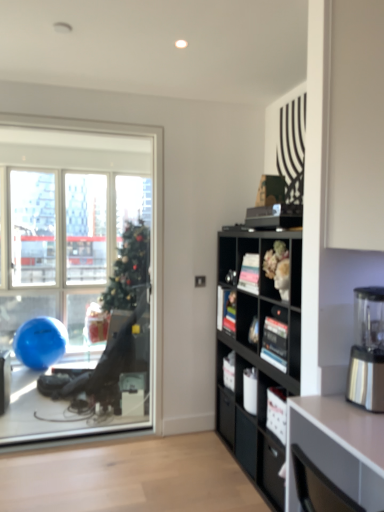
In order to face white glossy desk at lower right, should I rotate leftwards or rightwards?

It's best to rotate right around 22.415 degrees.

Identify the location of white glossy desk at lower right. Image resolution: width=384 pixels, height=512 pixels. (338, 447).

What is the approximate height of matte black bookshelf at center?

9.51 inches.

The width and height of the screenshot is (384, 512). What do you see at coordinates (257, 353) in the screenshot?
I see `black matte bookshelf at center-right` at bounding box center [257, 353].

Find the location of a particular element. stainless steel blender at right is located at coordinates (367, 350).

Where is `transparent glass window at left`? transparent glass window at left is located at coordinates (82, 272).

Find the location of a particular element. white glossy desk at lower right is located at coordinates (338, 447).

Considering the points (370, 478) and (65, 205), which point is in front, point (370, 478) or point (65, 205)?

Positioned in front is point (370, 478).

Locate an element on the screen. desk below the transparent glass window at left (from the image's perspective) is located at coordinates (338, 447).

Which object is closer to the camera taking this photo, white glossy desk at lower right or transparent glass window at left?

white glossy desk at lower right is closer to the camera.

Between point (370, 308) and point (332, 401), which one is positioned in front?

The point (332, 401) is in front.

Does stainless steel blender at right turn towards white glossy desk at lower right?

No, stainless steel blender at right is not aimed at white glossy desk at lower right.

Where is `coffee machine that is above the white glossy desk at lower right (from the image's perspective)`? The height and width of the screenshot is (512, 384). coffee machine that is above the white glossy desk at lower right (from the image's perspective) is located at coordinates (367, 350).

From the image's perspective, between stainless steel blender at right and white glossy desk at lower right, who is located below?

white glossy desk at lower right is shown below in the image.

Is point (294, 361) positioned before point (285, 505)?

No, it is not.

Considering the relative positions of matte black bookshelf at center and white glossy desk at lower right in the image provided, is matte black bookshelf at center to the left or to the right of white glossy desk at lower right?

Clearly, matte black bookshelf at center is on the right of white glossy desk at lower right in the image.

Can you tell me how much matte black bookshelf at center and white glossy desk at lower right differ in facing direction?

There is a 179-degree angle between the facing directions of matte black bookshelf at center and white glossy desk at lower right.

Image resolution: width=384 pixels, height=512 pixels. Identify the location of shelf on the right of the white glossy desk at lower right. (281, 338).

Is transparent glass window at left outside of white glossy desk at lower right?

Absolutely, transparent glass window at left is external to white glossy desk at lower right.

Consider the image. Can you see transparent glass window at left touching white glossy desk at lower right?

There is a gap between transparent glass window at left and white glossy desk at lower right.

Does transparent glass window at left have a lesser width compared to white glossy desk at lower right?

Correct, the width of transparent glass window at left is less than that of white glossy desk at lower right.

Is transparent glass window at left behind white glossy desk at lower right?

Yes, it is behind white glossy desk at lower right.

From the image's perspective, is white glossy desk at lower right under matte black bookshelf at center?

Yes.

Is matte black bookshelf at center surrounded by white glossy desk at lower right?

No, matte black bookshelf at center is not a part of white glossy desk at lower right.

Considering the positions of objects white glossy desk at lower right and matte black bookshelf at center in the image provided, who is in front, white glossy desk at lower right or matte black bookshelf at center?

white glossy desk at lower right.

From the image's perspective, is transparent glass window at left on top of stainless steel blender at right?

Indeed, from the image's perspective, transparent glass window at left is shown above stainless steel blender at right.

Do you think transparent glass window at left is within stainless steel blender at right, or outside of it?

transparent glass window at left lies outside stainless steel blender at right.

Is transparent glass window at left in front of or behind stainless steel blender at right in the image?

transparent glass window at left is positioned farther from the viewer than stainless steel blender at right.

How many degrees apart are the facing directions of transparent glass window at left and stainless steel blender at right?

The angular difference between transparent glass window at left and stainless steel blender at right is 13.2 degrees.

Identify the location of cabinetry behind the white glossy desk at lower right. (257, 353).

Considering the positions of objects black matte bookshelf at center-right and white glossy desk at lower right in the image provided, who is behind, black matte bookshelf at center-right or white glossy desk at lower right?

black matte bookshelf at center-right is more distant.

In terms of width, does black matte bookshelf at center-right look wider or thinner when compared to white glossy desk at lower right?

In the image, black matte bookshelf at center-right appears to be more narrow than white glossy desk at lower right.

Is white glossy desk at lower right at the back of black matte bookshelf at center-right?

No, black matte bookshelf at center-right is not facing the opposite direction of white glossy desk at lower right.

At what (x,y) coordinates should I click in order to perform the action: click on window above the white glossy desk at lower right (from a real-world perspective). Please return your answer as a coordinate pair (x, y). The height and width of the screenshot is (512, 384). Looking at the image, I should click on (82, 272).

At what (x,y) coordinates should I click in order to perform the action: click on desk that is under the stainless steel blender at right (from a real-world perspective). Please return your answer as a coordinate pair (x, y). The image size is (384, 512). Looking at the image, I should click on (338, 447).

Consider the image. Estimate the real-world distances between objects in this image. Which object is closer to transparent glass window at left, matte black bookshelf at center or black matte bookshelf at center-right?

Based on the image, black matte bookshelf at center-right appears to be nearer to transparent glass window at left.

Looking at the image, which one is located closer to black matte bookshelf at center-right, transparent glass window at left or stainless steel blender at right?

stainless steel blender at right is positioned closer to the anchor black matte bookshelf at center-right.

When comparing their distances from black matte bookshelf at center-right, does stainless steel blender at right or matte black bookshelf at center seem closer?

matte black bookshelf at center is closer to black matte bookshelf at center-right.

Which object lies further to the anchor point white glossy desk at lower right, transparent glass window at left or stainless steel blender at right?

transparent glass window at left lies further to white glossy desk at lower right than the other object.

Based on their spatial positions, is transparent glass window at left or white glossy desk at lower right closer to black matte bookshelf at center-right?

white glossy desk at lower right is closer to black matte bookshelf at center-right.

Which object lies nearer to the anchor point black matte bookshelf at center-right, transparent glass window at left or matte black bookshelf at center?

Based on the image, matte black bookshelf at center appears to be nearer to black matte bookshelf at center-right.

Which object lies nearer to the anchor point matte black bookshelf at center, white glossy desk at lower right or black matte bookshelf at center-right?

black matte bookshelf at center-right.

Based on their spatial positions, is stainless steel blender at right or white glossy desk at lower right closer to black matte bookshelf at center-right?

white glossy desk at lower right is positioned closer to the anchor black matte bookshelf at center-right.

The height and width of the screenshot is (512, 384). Identify the location of coffee machine between white glossy desk at lower right and black matte bookshelf at center-right from front to back. (367, 350).

Where is `shelf situated between transparent glass window at left and stainless steel blender at right from left to right`? shelf situated between transparent glass window at left and stainless steel blender at right from left to right is located at coordinates click(x=281, y=338).

At what (x,y) coordinates should I click in order to perform the action: click on shelf between white glossy desk at lower right and transparent glass window at left from front to back. Please return your answer as a coordinate pair (x, y). Looking at the image, I should click on (281, 338).

Locate an element on the screen. shelf situated between transparent glass window at left and black matte bookshelf at center-right from left to right is located at coordinates (281, 338).